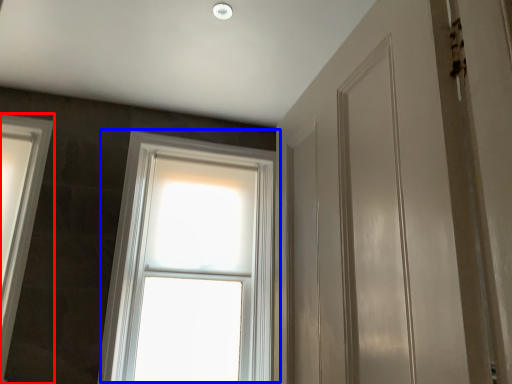
Question: Which object is further to the camera taking this photo, window (highlighted by a red box) or window (highlighted by a blue box)?

Choices:
 (A) window
 (B) window

Answer: (B)